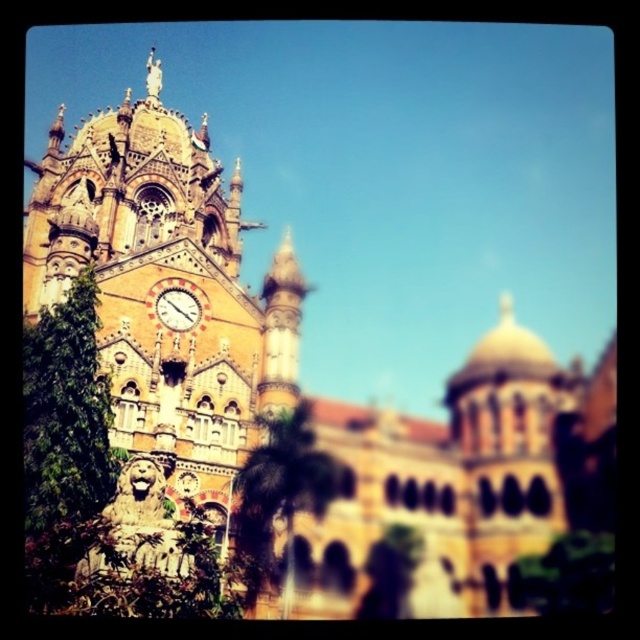
Between green leafy tree at center and green leafy tree at lower right, which one is positioned lower?

green leafy tree at lower right is below.

Does green leafy tree at center appear on the left side of green leafy tree at lower right?

Correct, you'll find green leafy tree at center to the left of green leafy tree at lower right.

Identify the location of green leafy tree at center. The height and width of the screenshot is (640, 640). (280, 493).

Can you confirm if green leafy tree at left is positioned below green leafy tree at center?

No, green leafy tree at left is not below green leafy tree at center.

Is green leafy tree at left thinner than green leafy tree at center?

Correct, green leafy tree at left's width is less than green leafy tree at center's.

The height and width of the screenshot is (640, 640). Identify the location of green leafy tree at left. (65, 413).

Does point (257, 508) come behind point (154, 310)?

No, it is not.

This screenshot has height=640, width=640. What are the coordinates of `green leafy tree at center` in the screenshot? It's located at (280, 493).